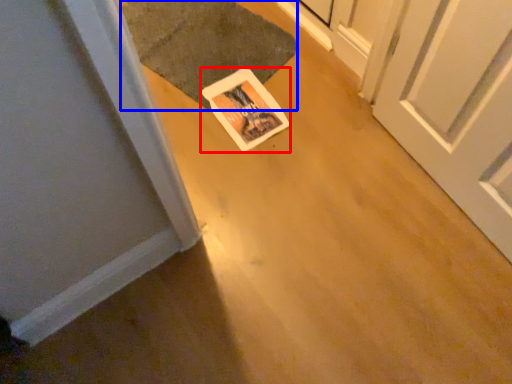
Question: Which point is further to the camera, postcard (highlighted by a red box) or doormat (highlighted by a blue box)?

Choices:
 (A) postcard
 (B) doormat

Answer: (B)